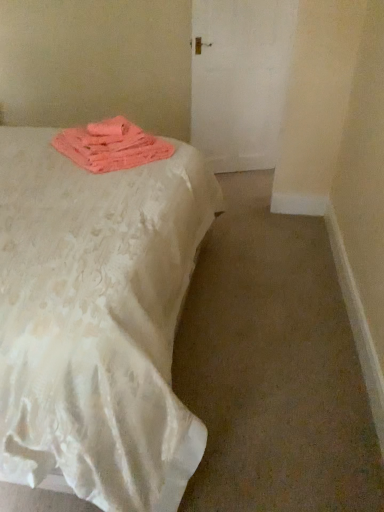
Question: Does pink fabric at upper left have a larger size compared to white textured bed at left?

Choices:
 (A) yes
 (B) no

Answer: (B)

Question: Could you tell me if pink fabric at upper left is turned towards white textured bed at left?

Choices:
 (A) yes
 (B) no

Answer: (A)

Question: Can you confirm if pink fabric at upper left is positioned to the right of white textured bed at left?

Choices:
 (A) no
 (B) yes

Answer: (B)

Question: Does pink fabric at upper left have a greater width compared to white textured bed at left?

Choices:
 (A) yes
 (B) no

Answer: (B)

Question: Is pink fabric at upper left smaller than white textured bed at left?

Choices:
 (A) yes
 (B) no

Answer: (A)

Question: Is pink fabric at upper left to the left of white textured bed at left from the viewer's perspective?

Choices:
 (A) yes
 (B) no

Answer: (B)

Question: Is white textured bed at left to the left of pink fabric at upper left from the viewer's perspective?

Choices:
 (A) yes
 (B) no

Answer: (A)

Question: Can you confirm if white textured bed at left is bigger than pink fabric at upper left?

Choices:
 (A) no
 (B) yes

Answer: (B)

Question: Is white textured bed at left facing towards pink fabric at upper left?

Choices:
 (A) yes
 (B) no

Answer: (A)

Question: Is white textured bed at left further to camera compared to pink fabric at upper left?

Choices:
 (A) no
 (B) yes

Answer: (A)

Question: Does white textured bed at left have a greater height compared to pink fabric at upper left?

Choices:
 (A) yes
 (B) no

Answer: (A)

Question: From a real-world perspective, is white textured bed at left beneath pink fabric at upper left?

Choices:
 (A) yes
 (B) no

Answer: (A)

Question: In the image, is pink fabric at upper left positioned in front of or behind white textured bed at left?

Choices:
 (A) behind
 (B) front

Answer: (A)